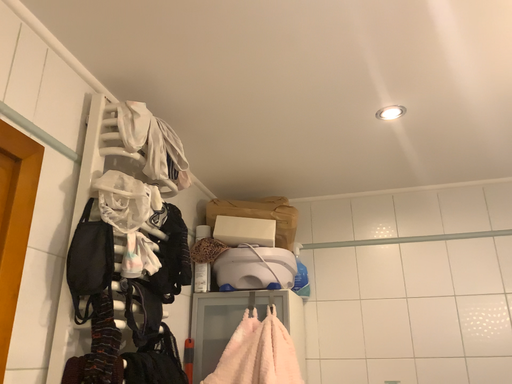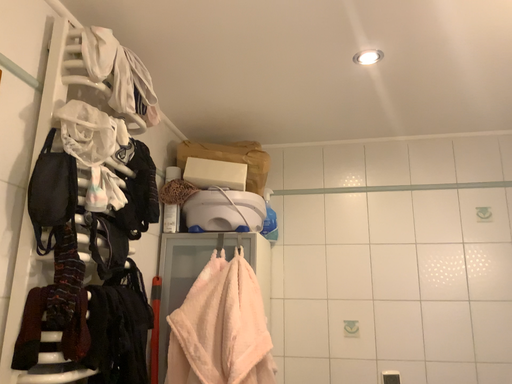
Question: How did the camera likely rotate when shooting the video?

Choices:
 (A) rotated downward
 (B) rotated upward

Answer: (A)